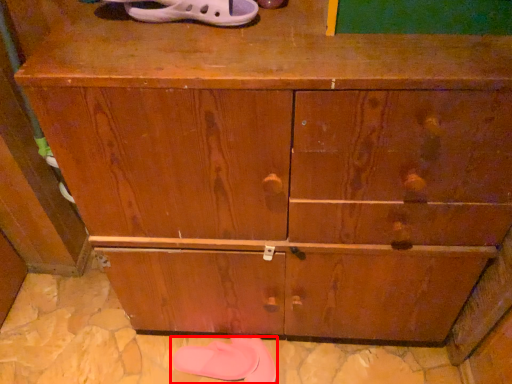
Question: Where is footwear (annotated by the red box) located in relation to footwear in the image?

Choices:
 (A) right
 (B) left

Answer: (B)